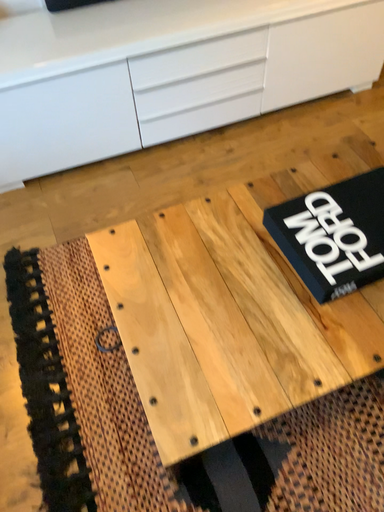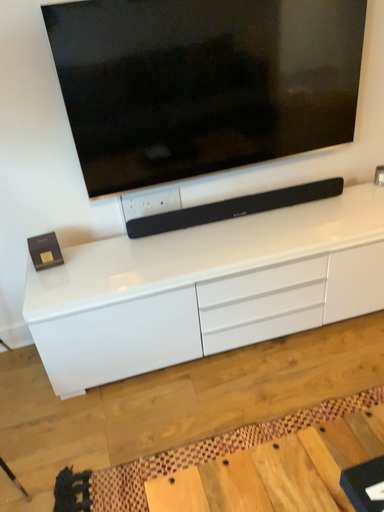
Question: How did the camera likely rotate when shooting the video?

Choices:
 (A) rotated upward
 (B) rotated downward

Answer: (A)